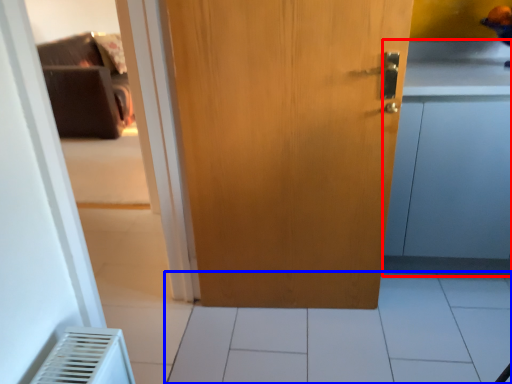
Question: Which object appears farthest to the camera in this image, cabinetry (highlighted by a red box) or tile (highlighted by a blue box)?

Choices:
 (A) cabinetry
 (B) tile

Answer: (A)